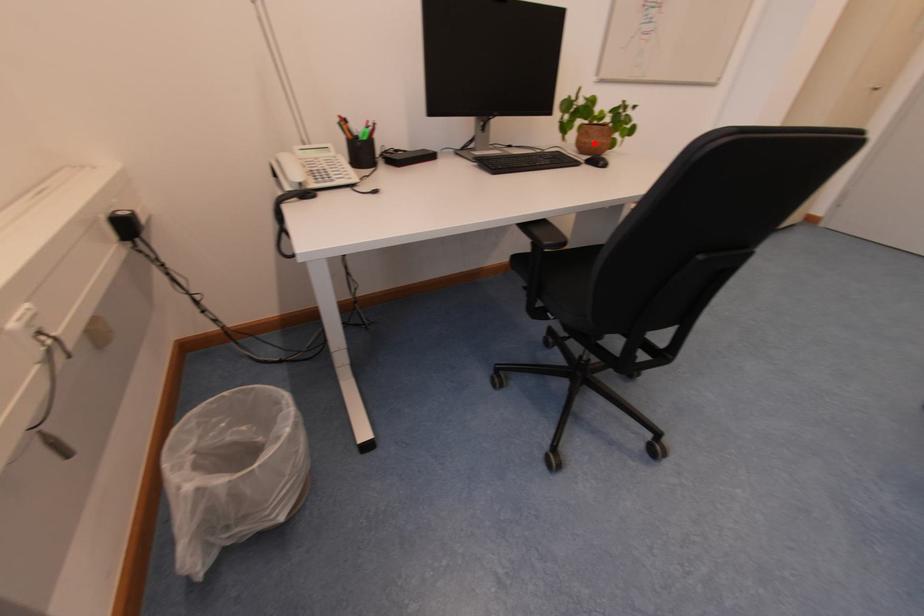
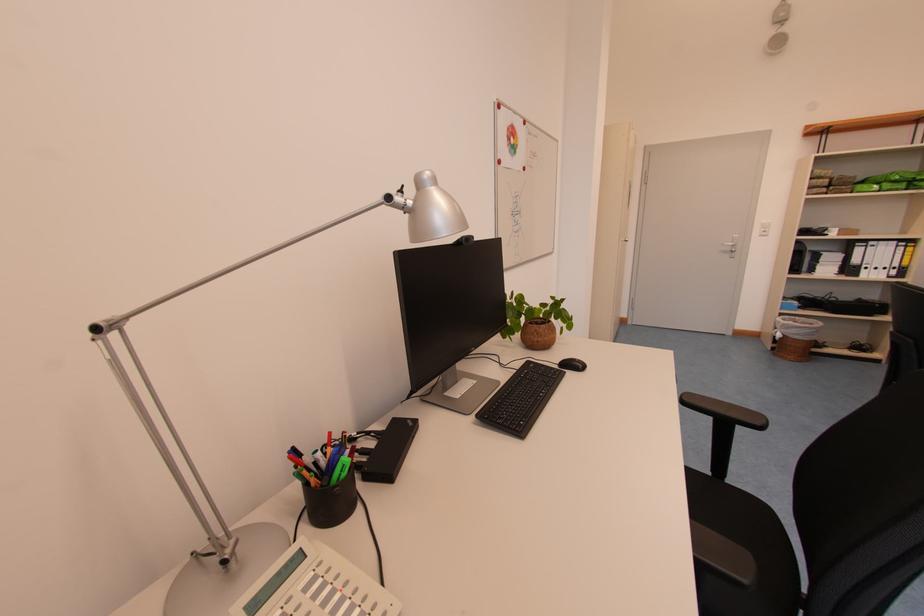
Find the pixel in the second image that matches the highlighted location in the first image.

(546, 342)